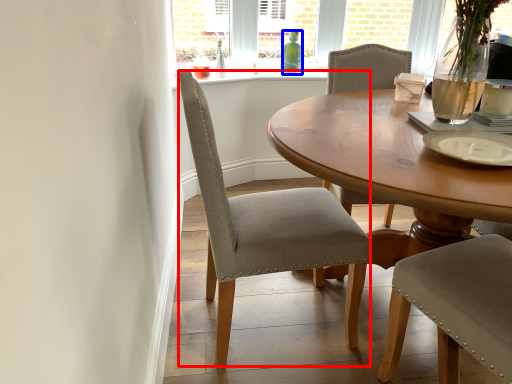
Question: Which object appears farthest to the camera in this image, chair (highlighted by a red box) or bottle (highlighted by a blue box)?

Choices:
 (A) chair
 (B) bottle

Answer: (B)